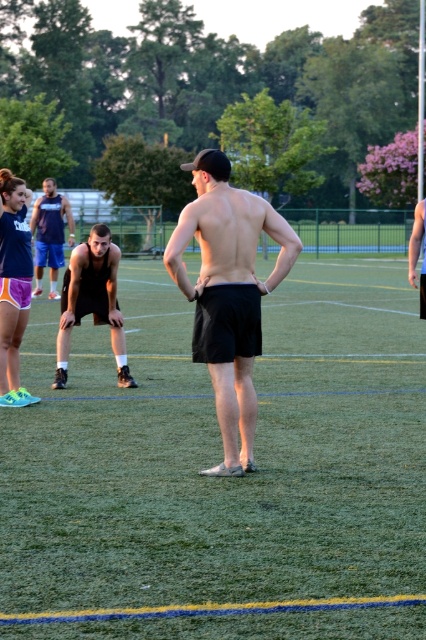
You are a photographer positioned at the center of the field. You need to capture a photo that includes both the black matte shorts at center and the black matte shorts at lower left. Based on their positions, which direction should you move to ensure both are in frame?

The black matte shorts at center is to the right of the black matte shorts at lower left. To include both in the frame, you should move to the left so that both the black matte shorts at center and the black matte shorts at lower left are visible.